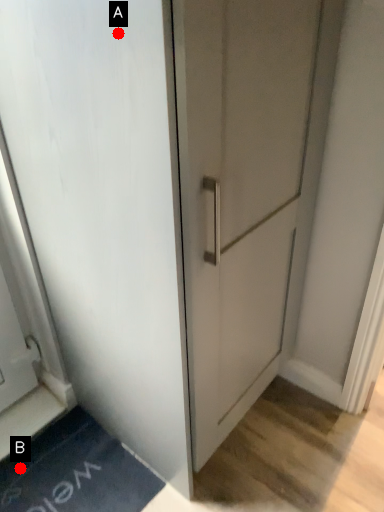
Question: Two points are circled on the image, labeled by A and B beside each circle. Which point is closer to the camera?

Choices:
 (A) A is closer
 (B) B is closer

Answer: (A)